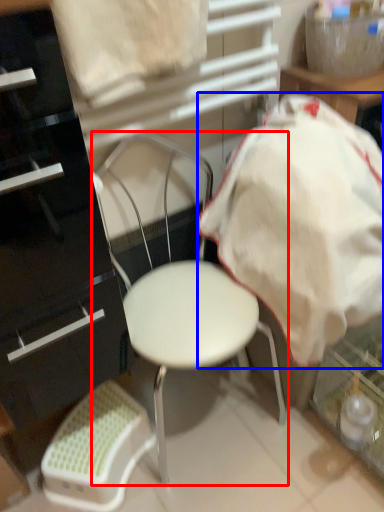
Question: Which of the following is the closest to the observer, chair (highlighted by a red box) or blanket (highlighted by a blue box)?

Choices:
 (A) chair
 (B) blanket

Answer: (A)